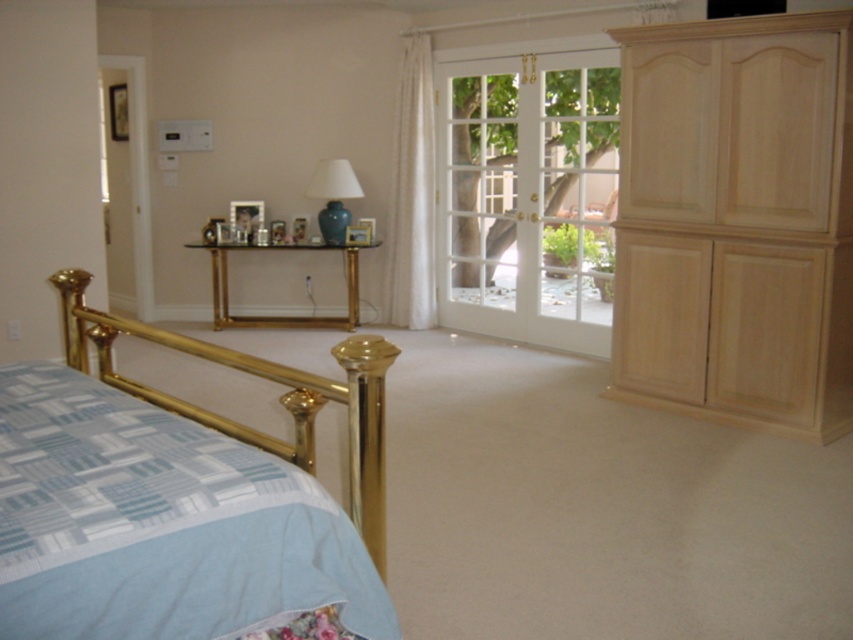
Question: Which point is closer to the camera?

Choices:
 (A) (831, 244)
 (B) (160, 451)
 (C) (614, 124)

Answer: (B)

Question: Does light wood dresser at right have a larger size compared to white glass screen door at upper left?

Choices:
 (A) no
 (B) yes

Answer: (B)

Question: Among these points, which one is nearest to the camera?

Choices:
 (A) (335, 557)
 (B) (393, 298)
 (C) (822, 298)

Answer: (A)

Question: Does light wood dresser at right appear under white glass screen door at upper left?

Choices:
 (A) yes
 (B) no

Answer: (A)

Question: Can you confirm if white sheer curtain at center is bigger than white glass screen door at upper left?

Choices:
 (A) yes
 (B) no

Answer: (A)

Question: Which object appears farthest from the camera in this image?

Choices:
 (A) light wood dresser at right
 (B) white glass door at center
 (C) white sheer curtain at center
 (D) white glass screen door at upper left

Answer: (D)